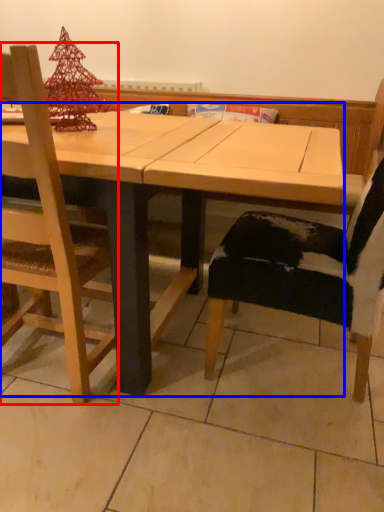
Question: Which point is closer to the camera, chair (highlighted by a red box) or table (highlighted by a blue box)?

Choices:
 (A) chair
 (B) table

Answer: (A)